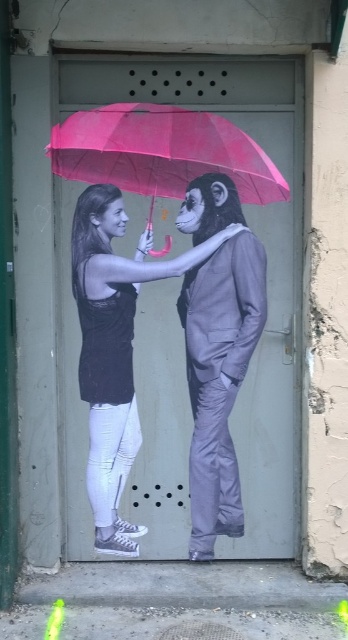
You are a painter who needs to touch up the mural on the door. The matte black suit at center and the pink matte umbrella at upper center are both chipped. You have a ladder that can reach up to 3 meters. Can you safely reach both objects without moving the ladder?

Result: The distance between the matte black suit at center and the pink matte umbrella at upper center is 32.63 centimeters, so yes, you can safely reach both objects without moving the ladder since the ladder can reach up to 3 meters, which is much higher than the distance between them.

Based on the mural described, can you determine the spatial relationship between the matte black suit at center and the pink matte umbrella at upper center?

The matte black suit at center is located below the pink matte umbrella at upper center.